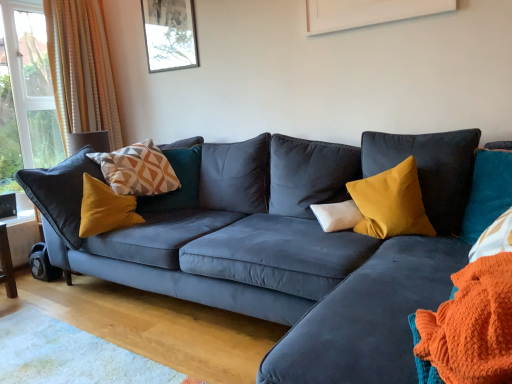
Question: Would you say orange striped curtain at left is a long distance from orange knitted blanket at lower right?

Choices:
 (A) no
 (B) yes

Answer: (B)

Question: Considering the relative positions of orange striped curtain at left and orange knitted blanket at lower right in the image provided, is orange striped curtain at left in front of orange knitted blanket at lower right?

Choices:
 (A) no
 (B) yes

Answer: (A)

Question: From the image's perspective, would you say orange striped curtain at left is positioned over orange knitted blanket at lower right?

Choices:
 (A) yes
 (B) no

Answer: (A)

Question: Considering the relative sizes of orange striped curtain at left and orange knitted blanket at lower right in the image provided, is orange striped curtain at left shorter than orange knitted blanket at lower right?

Choices:
 (A) no
 (B) yes

Answer: (A)

Question: Can you confirm if orange striped curtain at left is smaller than orange knitted blanket at lower right?

Choices:
 (A) yes
 (B) no

Answer: (B)

Question: Which is correct: matte glass picture frame at upper center is inside velvet mustard pillow at center, positioned as the 1th pillow in right-to-left order, or outside of it?

Choices:
 (A) inside
 (B) outside

Answer: (B)

Question: Does point 187,11 appear closer or farther from the camera than point 378,177?

Choices:
 (A) closer
 (B) farther

Answer: (B)

Question: Is matte glass picture frame at upper center to the left or to the right of velvet mustard pillow at center, positioned as the third pillow in left-to-right order, in the image?

Choices:
 (A) right
 (B) left

Answer: (B)

Question: From a real-world perspective, is matte glass picture frame at upper center above or below velvet mustard pillow at center, positioned as the third pillow in left-to-right order?

Choices:
 (A) above
 (B) below

Answer: (A)

Question: Based on their positions, is orange knitted blanket at lower right located to the left or right of geometric-patterned fabric pillow at left, marked as the third pillow in a right-to-left arrangement?

Choices:
 (A) left
 (B) right

Answer: (B)

Question: From a real-world perspective, is orange knitted blanket at lower right above or below geometric-patterned fabric pillow at left, marked as the third pillow in a right-to-left arrangement?

Choices:
 (A) above
 (B) below

Answer: (B)

Question: In the image, is orange knitted blanket at lower right positioned in front of or behind geometric-patterned fabric pillow at left, marked as the third pillow in a right-to-left arrangement?

Choices:
 (A) front
 (B) behind

Answer: (A)

Question: Would you say orange knitted blanket at lower right is inside or outside geometric-patterned fabric pillow at left, positioned as the first pillow in left-to-right order?

Choices:
 (A) inside
 (B) outside

Answer: (B)

Question: From a real-world perspective, relative to geometric-patterned fabric pillow at left, positioned as the first pillow in left-to-right order, is matte glass picture frame at upper center vertically above or below?

Choices:
 (A) above
 (B) below

Answer: (A)

Question: Looking at their shapes, would you say matte glass picture frame at upper center is wider or thinner than geometric-patterned fabric pillow at left, positioned as the first pillow in left-to-right order?

Choices:
 (A) wide
 (B) thin

Answer: (B)